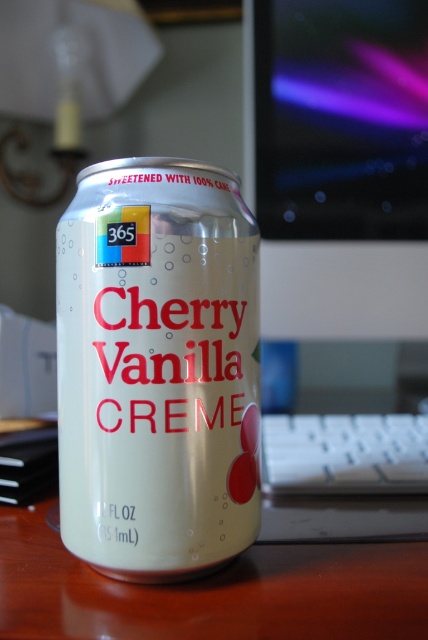
Between white matte can at center and glossy plastic monitor at upper center, which one is positioned higher?

glossy plastic monitor at upper center is above.

Who is more forward, [83,492] or [281,54]?

Point [83,492] is more forward.

Image resolution: width=428 pixels, height=640 pixels. What are the coordinates of `white matte can at center` in the screenshot? It's located at (157, 369).